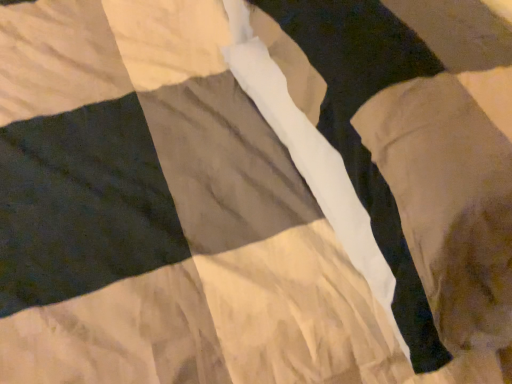
What do you see at coordinates (359, 135) in the screenshot?
I see `matte white pants at center` at bounding box center [359, 135].

Where is `matte white pants at center`? The height and width of the screenshot is (384, 512). matte white pants at center is located at coordinates (359, 135).

The height and width of the screenshot is (384, 512). In order to click on matte white pants at center in this screenshot , I will do `click(359, 135)`.